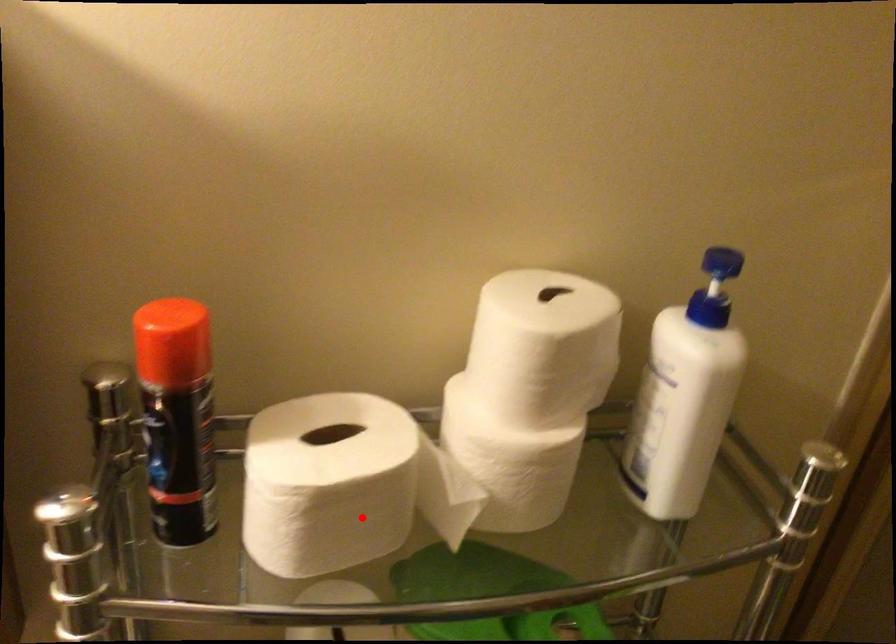
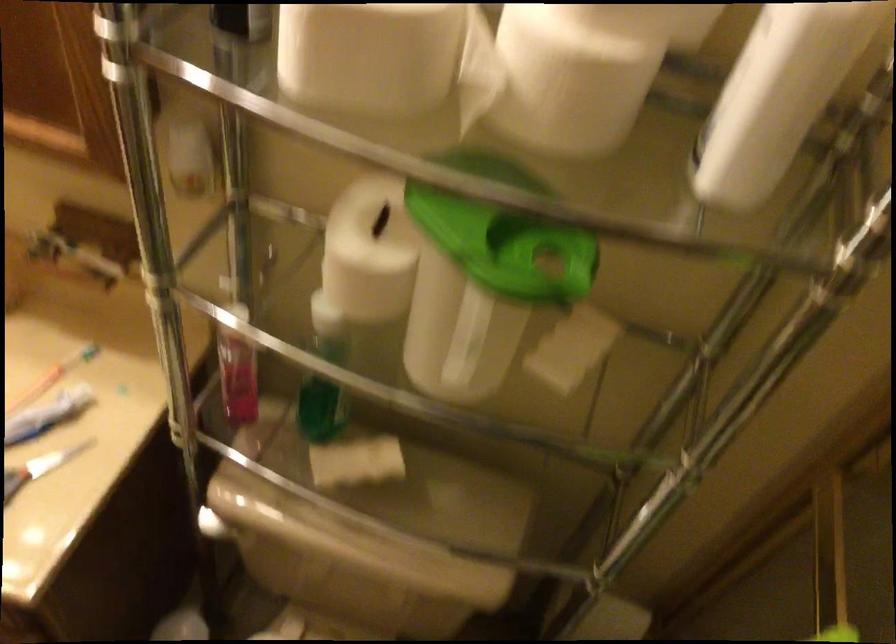
Where in the second image is the point corresponding to the highlighted location from the first image?

(368, 55)